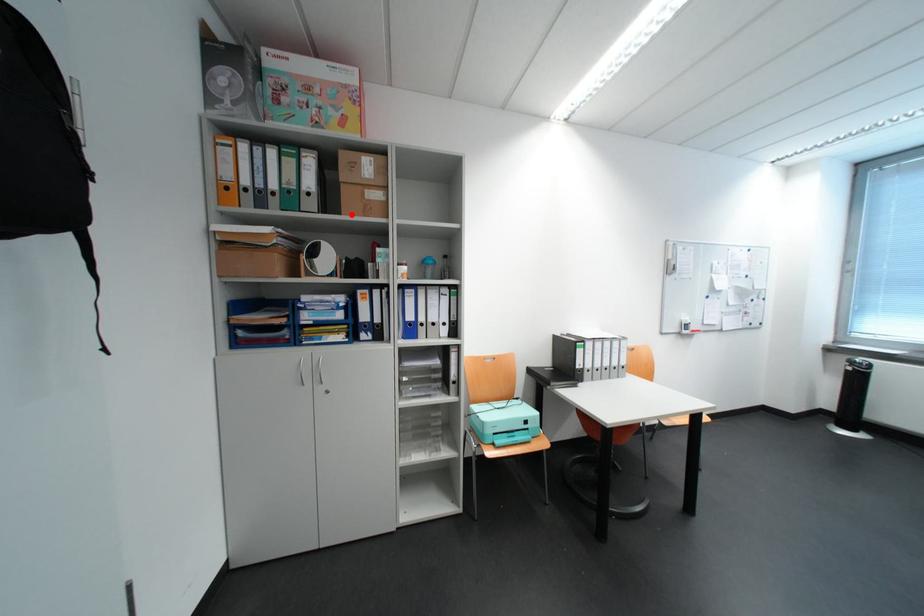
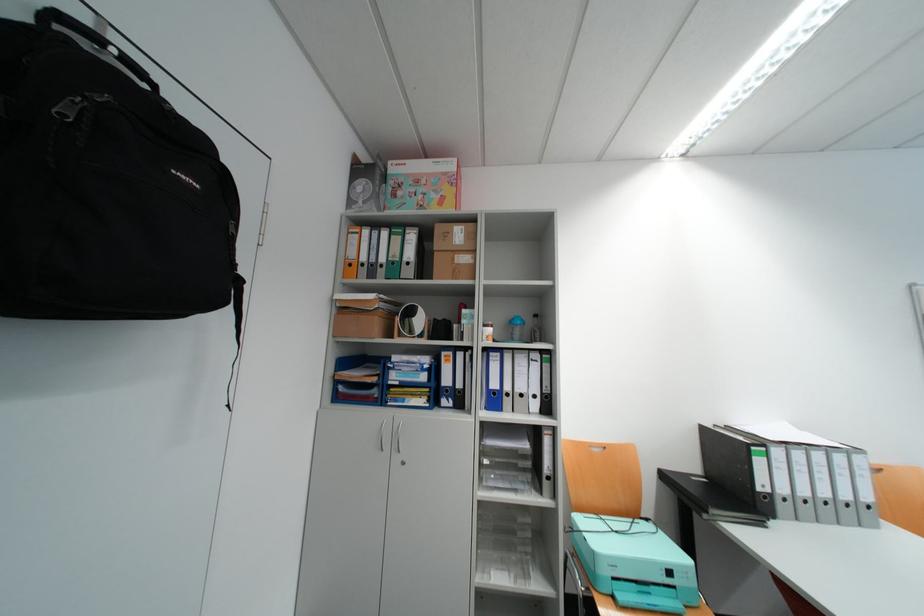
Question: I am providing you with two images of the same scene from different viewpoints. A red point is marked on the first image. Can you still see the location of the red point in image 2?

Choices:
 (A) Yes
 (B) No

Answer: (A)